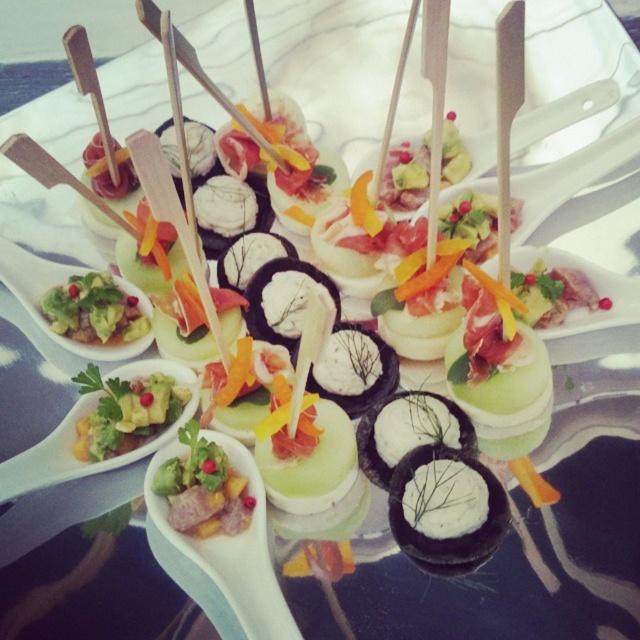
Where is `green leafy salad at center`? green leafy salad at center is located at coordinates (202, 488).

Is green leafy salad at center wider than green avocado spread at center?

No, green leafy salad at center is not wider than green avocado spread at center.

What do you see at coordinates (202, 488) in the screenshot? I see `green leafy salad at center` at bounding box center [202, 488].

Image resolution: width=640 pixels, height=640 pixels. I want to click on green leafy salad at center, so click(202, 488).

What do you see at coordinates (202, 488) in the screenshot? I see `green leafy salad at center` at bounding box center [202, 488].

Who is taller, green leafy salad at center or green guacamole at center?

green leafy salad at center is taller.

Does point (166, 460) come in front of point (132, 394)?

Yes, point (166, 460) is closer to viewer.

At what (x,y) coordinates should I click in order to perform the action: click on green leafy salad at center. Please return your answer as a coordinate pair (x, y). Image resolution: width=640 pixels, height=640 pixels. Looking at the image, I should click on (202, 488).

Consider the image. Which is more to the left, green guacamole at center or green avocado spread at center?

From the viewer's perspective, green avocado spread at center appears more on the left side.

At what (x,y) coordinates should I click in order to perform the action: click on green guacamole at center. Please return your answer as a coordinate pair (x, y). The image size is (640, 640). Looking at the image, I should click on (124, 412).